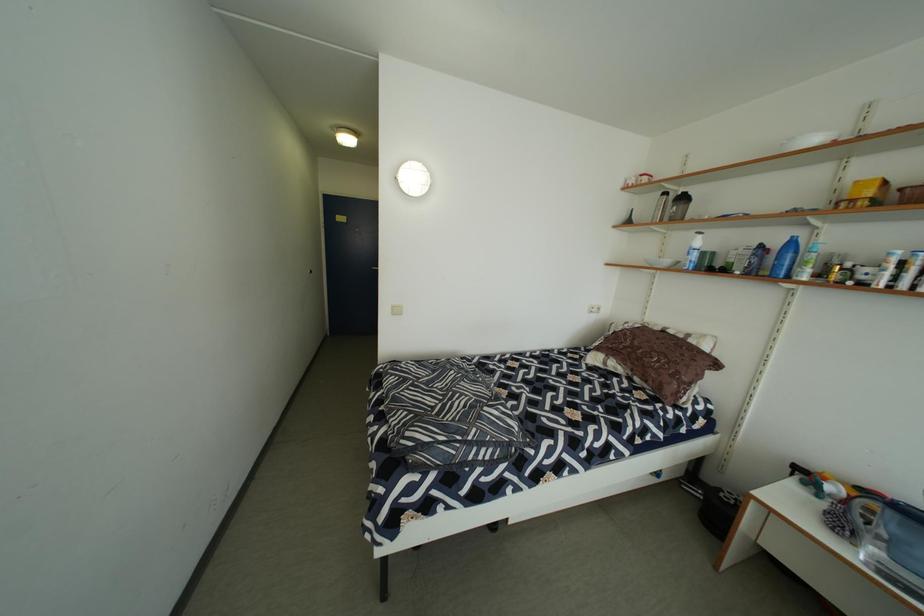
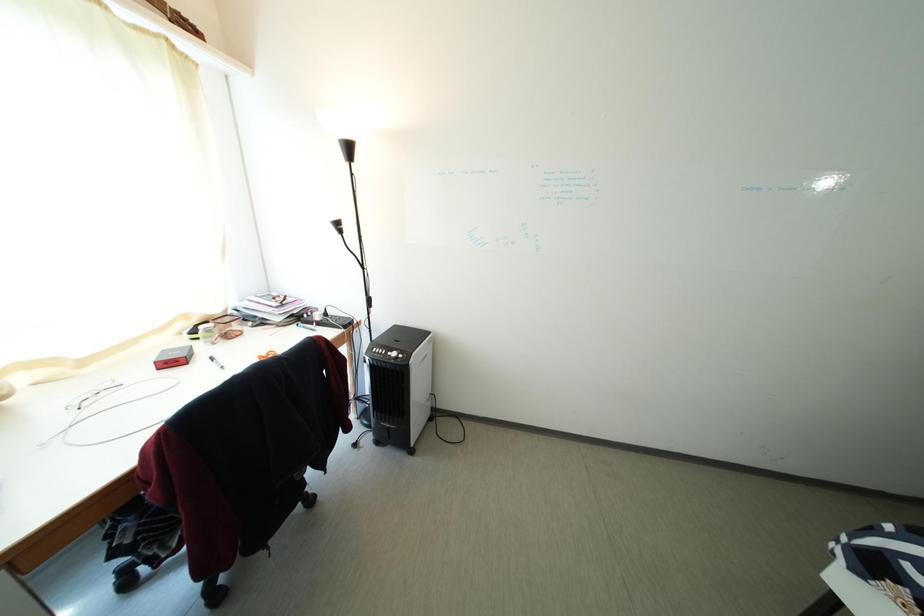
How did the camera likely rotate?

The camera rotated toward left-down.